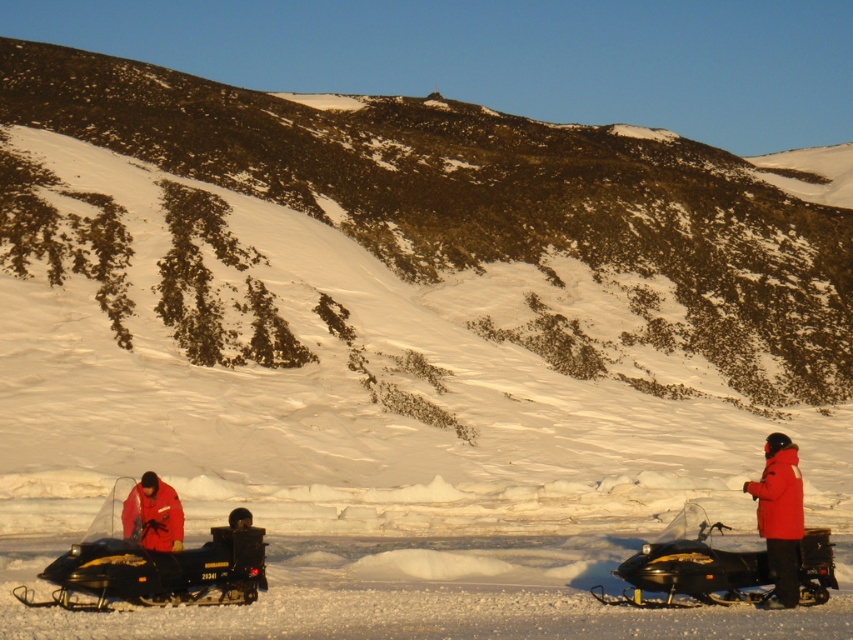
You are a photographer trying to capture a photo of both the black matte snowmobile at lower left and the red synthetic jacket at right. Since you want both subjects to be in focus, which one should you adjust your camera focus on first?

The black matte snowmobile at lower left is closer to the viewer than the red synthetic jacket at right. Since the snowmobile is closer, you should focus on it first to ensure both are in focus.

You are planning to take a photo of the black matte snowmobile at lower left and the red synthetic jacket at right together in the same frame. Given that your camera has a maximum focus range of 12 meters, will you be able to capture both subjects clearly in one shot?

The black matte snowmobile at lower left and red synthetic jacket at right are 13.17 meters apart from each other, which exceeds the camera maximum focus range of 12 meters. Therefore, you will not be able to capture both subjects clearly in one shot.

You are a photographer trying to capture the best shot of the black plastic snowmobile at right. Based on its position coordinates, where should you aim your camera to ensure it is centered in the frame?

To center the black plastic snowmobile at right in the frame, aim your camera at its position coordinates at point (689, 566).